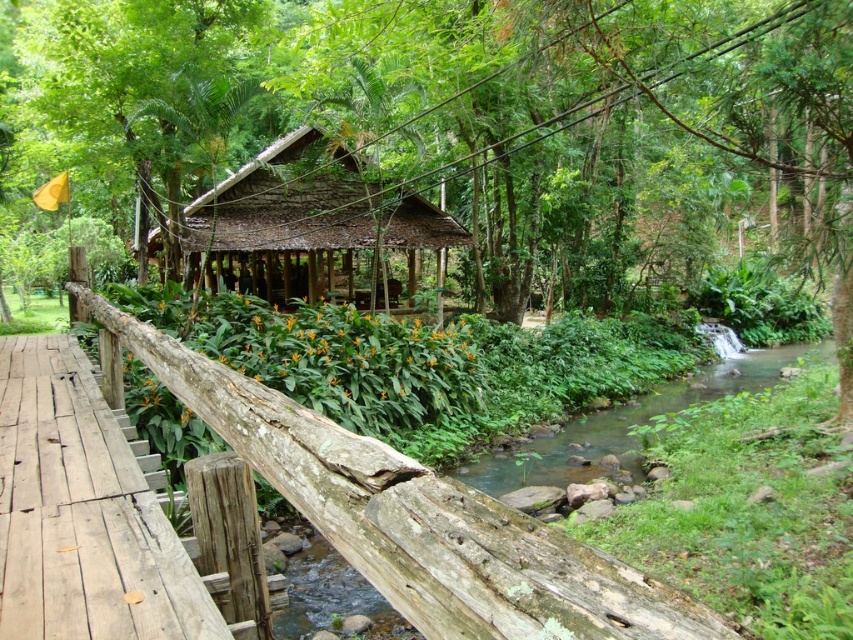
Who is positioned more to the right, wooden bridge at center or green mossy river at center?

green mossy river at center

Does point (415, 595) lie in front of point (299, 589)?

Yes, it is.

Is point (349, 488) positioned in front of point (601, 445)?

Yes, point (349, 488) is in front of point (601, 445).

Identify the location of wooden bridge at center. (416, 518).

How distant is green leafy forest at center from green mossy river at center?

They are 34.78 feet apart.

Does green leafy forest at center have a greater width compared to green mossy river at center?

Yes.

Between point (534, 205) and point (703, 397), which one is positioned behind?

Positioned behind is point (534, 205).

The width and height of the screenshot is (853, 640). What are the coordinates of `green leafy forest at center` in the screenshot? It's located at (437, 141).

Between point (691, 131) and point (413, 244), which one is positioned in front?

Point (691, 131) is more forward.

At what (x,y) coordinates should I click in order to perform the action: click on green leafy forest at center. Please return your answer as a coordinate pair (x, y). The image size is (853, 640). Looking at the image, I should click on (437, 141).